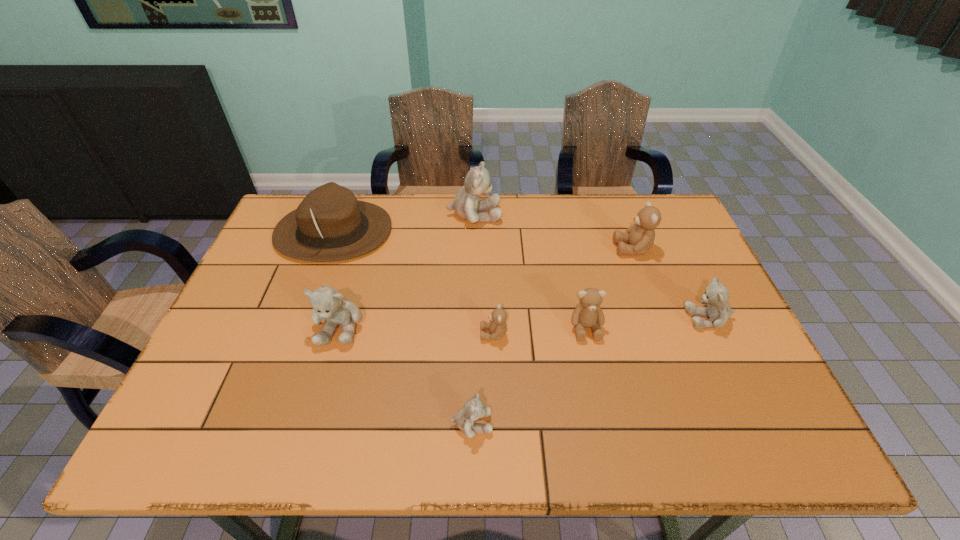
You are a GUI agent. You are given a task and a screenshot of the screen. Output one action in this format:
    pyautogui.click(x=<x>, y=<y>)
    Task: Click on the free space located 0.160m on the front-facing side of the third teddy bear from right to left
    The width and height of the screenshot is (960, 540).
    Given the screenshot: What is the action you would take?
    pyautogui.click(x=602, y=401)

You are a GUI agent. You are given a task and a screenshot of the screen. Output one action in this format:
    pyautogui.click(x=<x>, y=<y>)
    Task: Click on the vacant point located on the face of the rightmost gray teddy bear
    
    Given the screenshot: What is the action you would take?
    click(x=573, y=319)

This screenshot has width=960, height=540. I want to click on free space located 0.120m on the face of the rightmost gray teddy bear, so click(639, 319).

You are a GUI agent. You are given a task and a screenshot of the screen. Output one action in this format:
    pyautogui.click(x=<x>, y=<y>)
    Task: Click on the vacant region located 0.330m on the face of the rightmost gray teddy bear
    The width and height of the screenshot is (960, 540).
    Given the screenshot: What is the action you would take?
    pyautogui.click(x=558, y=319)

Find the location of a particular element. The width and height of the screenshot is (960, 540). vacant space located 0.120m on the front-facing side of the smallest brown teddy bear is located at coordinates (432, 334).

Locate an element on the screen. vacant space situated 0.240m on the front-facing side of the smallest brown teddy bear is located at coordinates (385, 334).

Identify the location of free spot located on the front-facing side of the smallest brown teddy bear. This screenshot has height=540, width=960. (417, 334).

Locate an element on the screen. vacant space situated 0.160m on the face of the nearest teddy bear is located at coordinates (567, 424).

Locate an element on the screen. fedora at the far edge is located at coordinates (330, 224).

Where is `object located at the near edge`? The height and width of the screenshot is (540, 960). object located at the near edge is located at coordinates (473, 409).